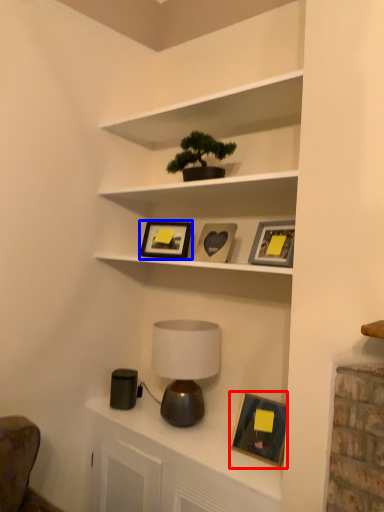
Question: Which object is closer to the camera taking this photo, picture frame (highlighted by a red box) or picture frame (highlighted by a blue box)?

Choices:
 (A) picture frame
 (B) picture frame

Answer: (A)